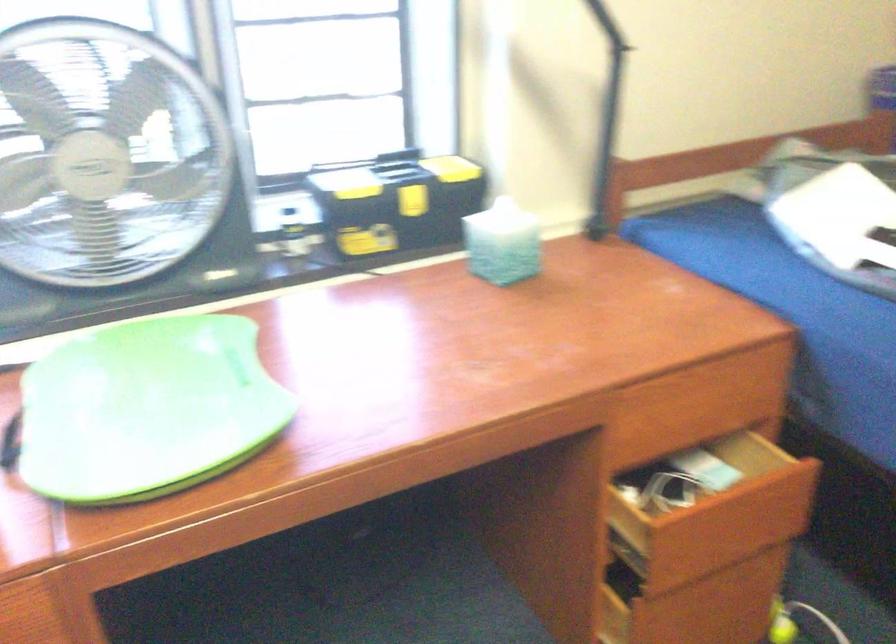
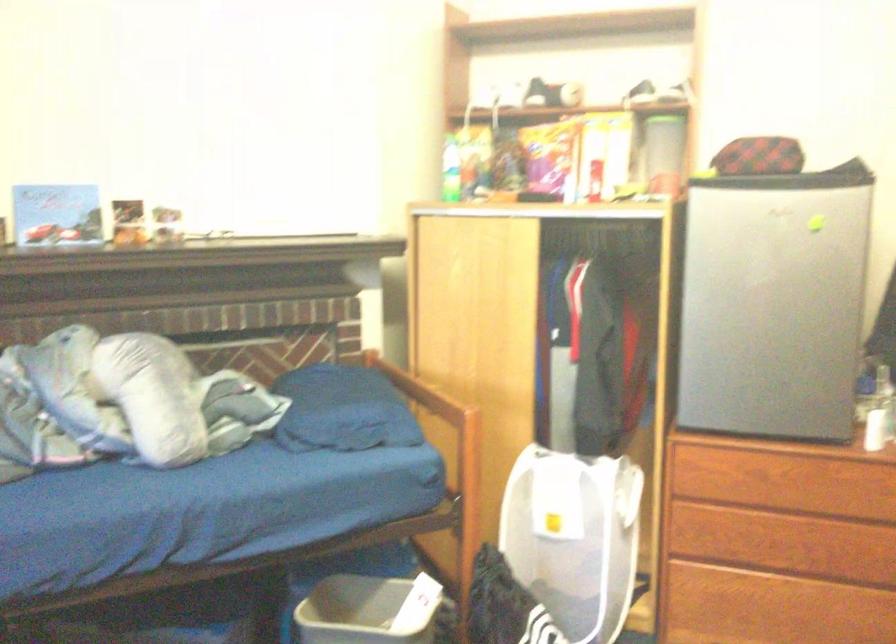
Question: The camera is either moving clockwise (left) or counter-clockwise (right) around the object. The first image is from the beginning of the video and the second image is from the end. Is the camera moving left or right when shooting the video?

Choices:
 (A) Left
 (B) Right

Answer: (A)